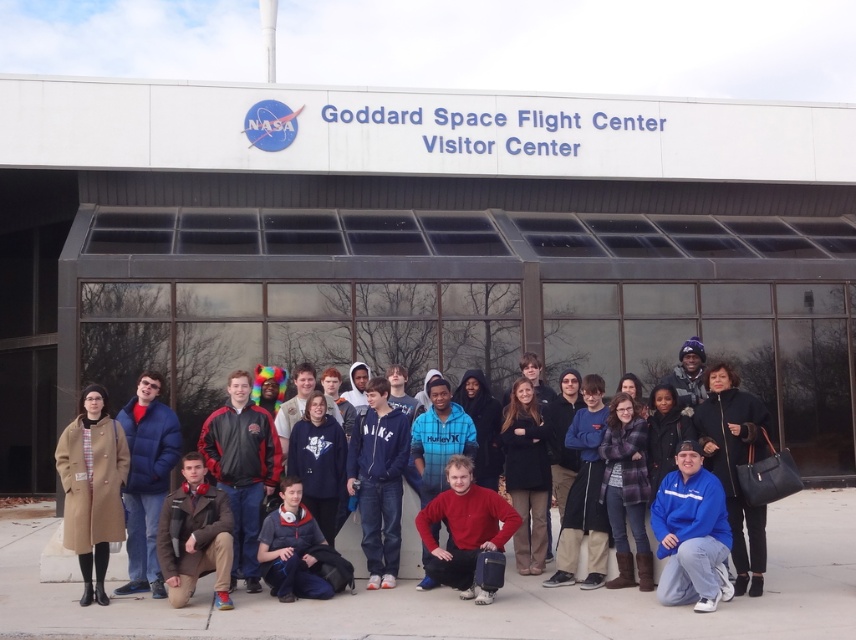
In the scene shown: You are a photographer trying to capture a photo of the group in front of the Goddard Space Flight Center Visitor Center. You notice the blue puffy jacket at center and the brown leather jacket at lower left. Which jacket should you focus on to ensure the subject is taller in the frame?

The blue puffy jacket at center is taller than the brown leather jacket at lower left, so focusing on the blue puffy jacket at center will ensure the subject appears taller in the frame.

You are a photographer taking a group photo at the Goddard Space Flight Center Visitor Center. You need to ensure that the dark brown leather jacket at center and the blue puffy jacket at center are both visible in the photo. Which jacket should you focus on to ensure the taller one is fully captured?

The blue puffy jacket at center is taller than the dark brown leather jacket at center, so focusing on the blue puffy jacket at center ensures the taller one is fully captured.

You are a photographer trying to capture a group photo of the people at the Goddard Space Flight Center Visitor Center. You notice two individuals wearing blue jackets. The first is wearing a blue fleece jacket at lower right, and the other is wearing a blue puffy jacket at center. Based on their jacket sizes, which jacket appears smaller in the photo?

The blue fleece jacket at lower right appears smaller in the photo because its width is less than that of the blue puffy jacket at center.